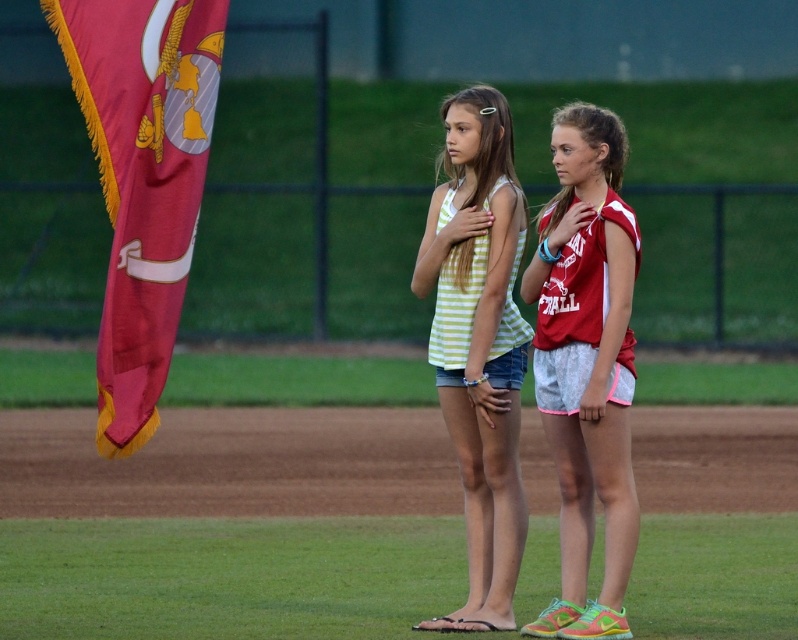
Who is shorter, red fabric flag at left or red jersey shorts at center?

red fabric flag at left is shorter.

At what (x,y) coordinates should I click in order to perform the action: click on red fabric flag at left. Please return your answer as a coordinate pair (x, y). The width and height of the screenshot is (798, 640). Looking at the image, I should click on (141, 179).

Which is in front, point (184, 241) or point (591, 273)?

Positioned in front is point (184, 241).

Find the location of a particular element. This screenshot has width=798, height=640. red fabric flag at left is located at coordinates (141, 179).

Can you confirm if red fabric flag at left is shorter than striped fabric tank top at center?

Correct, red fabric flag at left is not as tall as striped fabric tank top at center.

In the scene shown: Who is more distant from viewer, (x=89, y=90) or (x=484, y=108)?

The point (x=484, y=108) is more distant.

Locate an element on the screen. This screenshot has height=640, width=798. red fabric flag at left is located at coordinates (141, 179).

Find the location of `red fabric flag at left`. red fabric flag at left is located at coordinates (x=141, y=179).

Is red jersey shorts at center above striped fabric tank top at center?

Actually, red jersey shorts at center is below striped fabric tank top at center.

Is red jersey shorts at center closer to the viewer compared to striped fabric tank top at center?

Yes.

Where is `red jersey shorts at center`? red jersey shorts at center is located at coordinates (587, 364).